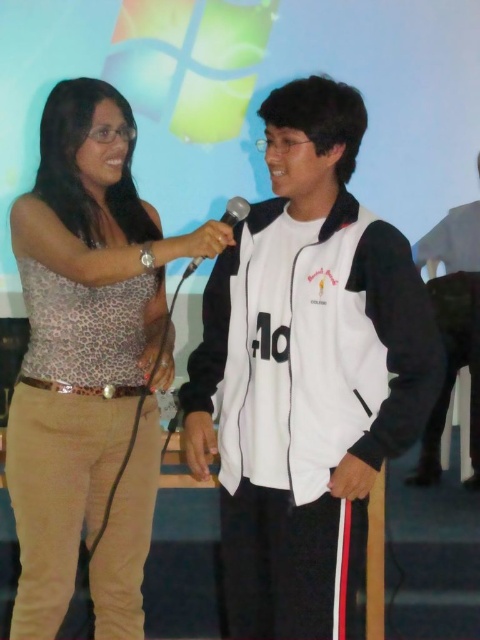
Question: Can you confirm if leopard print tank top at left is positioned to the left of black metallic microphone at center?

Choices:
 (A) no
 (B) yes

Answer: (B)

Question: Which point is farther from the camera taking this photo?

Choices:
 (A) (369, 262)
 (B) (193, 262)
 (C) (92, 396)

Answer: (C)

Question: Among these points, which one is farthest from the camera?

Choices:
 (A) (188, 268)
 (B) (297, 536)

Answer: (B)

Question: Is white matte jacket at center behind leopard print tank top at left?

Choices:
 (A) yes
 (B) no

Answer: (B)

Question: Does leopard print tank top at left have a greater width compared to black metallic microphone at center?

Choices:
 (A) yes
 (B) no

Answer: (A)

Question: Which point is closer to the camera taking this photo?

Choices:
 (A) (24, 376)
 (B) (239, 220)
 (C) (287, 616)

Answer: (C)